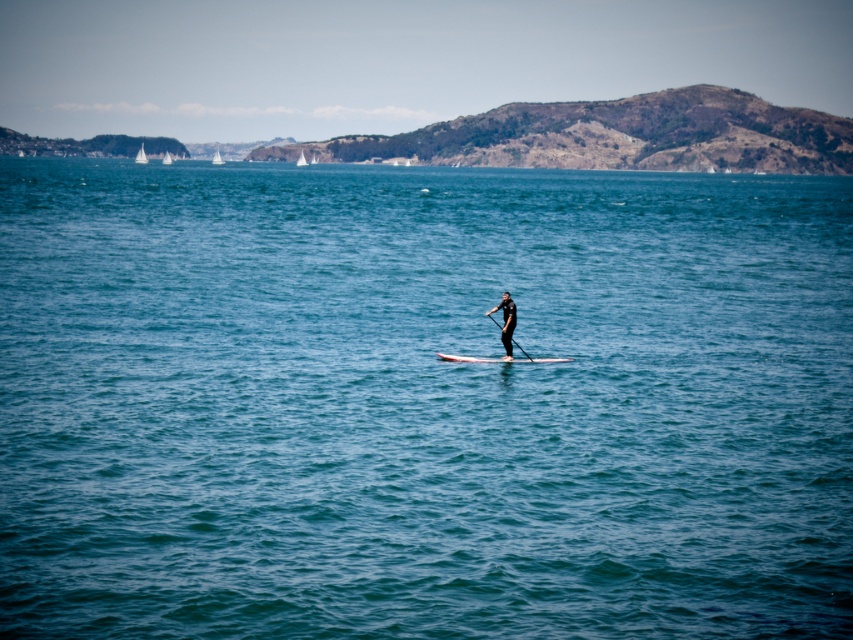
You are a photographer trying to capture the paddleboarder in the image. You want to ensure both the white foam surfboard at center and the white glossy paddleboard at center are clearly visible in your shot. Based on their positions, which one is closer to the water surface?

The white foam surfboard at center is located below the white glossy paddleboard at center, meaning it is closer to the water surface.

You are a photographer trying to capture a clear photo of both the white foam surfboard at center and the white glossy paddleboard at center. Given that your camera can only focus on objects within a 12 inch range, will you be able to get both in focus?

The white foam surfboard at center and white glossy paddleboard at center are 15.05 inches apart, which exceeds the camera focus range of 12 inches. Therefore, both cannot be in focus simultaneously.

You are a photographer trying to capture the white foam surfboard at center in the image. Based on its coordinates, where should you focus your camera?

The white foam surfboard at center is located at coordinates point (500, 358), so you should focus your camera there.